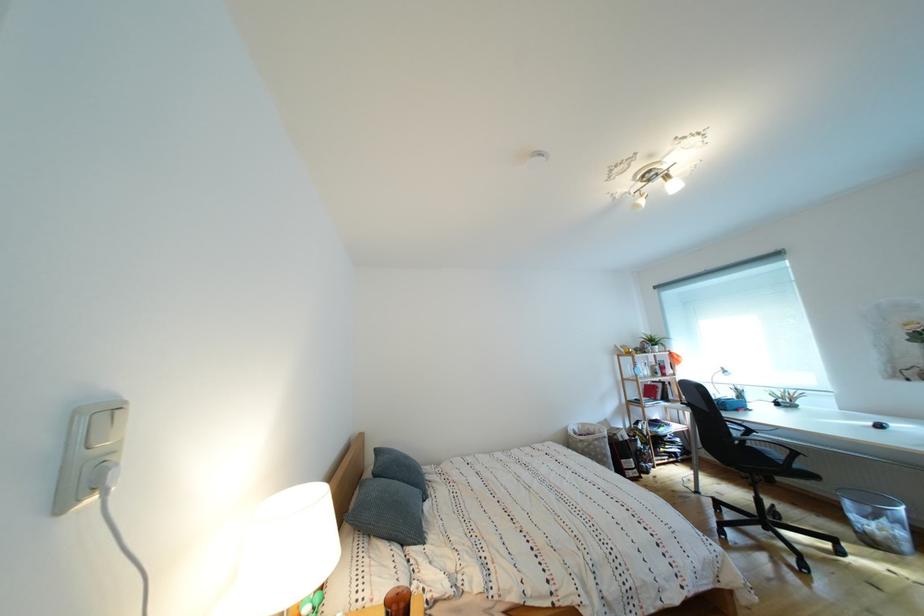
Which object does [590,442] point to?

It corresponds to the woven laundry basket in the image.